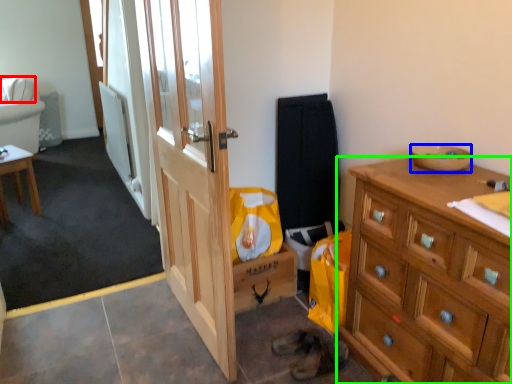
Question: Which is farther away from pillow (highlighted by a red box)? bowl (highlighted by a blue box) or cabinetry (highlighted by a green box)?

Choices:
 (A) bowl
 (B) cabinetry

Answer: (B)